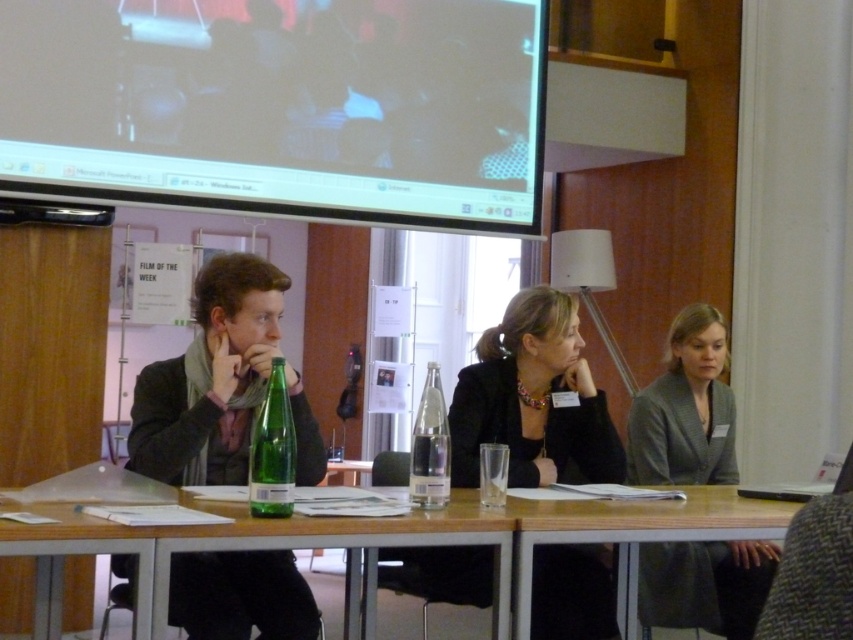
From the picture: You are a photographer setting up for a group photo. You need to ensure that the dark gray suit at center and the clear glass bottle at center are both visible in the frame. Which object will appear taller in the final photo?

The dark gray suit at center will appear taller in the final photo because it is taller than the clear glass bottle at center according to the description.

You are organizing a presentation and need to place a laptop between the matte black jacket at center and the clear glass bottle at center on the table. Can the laptop fit between them if the laptop is 10 cm wide?

The matte black jacket at center is wider than the clear glass bottle at center. However, without knowing the exact distance between them, it is impossible to determine if the laptop will fit.